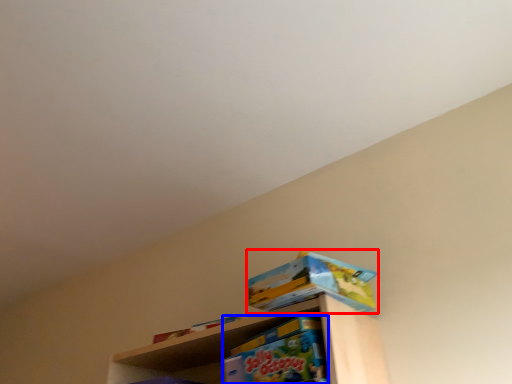
Question: Among these objects, which one is nearest to the camera, toy (highlighted by a red box) or toy (highlighted by a blue box)?

Choices:
 (A) toy
 (B) toy

Answer: (B)